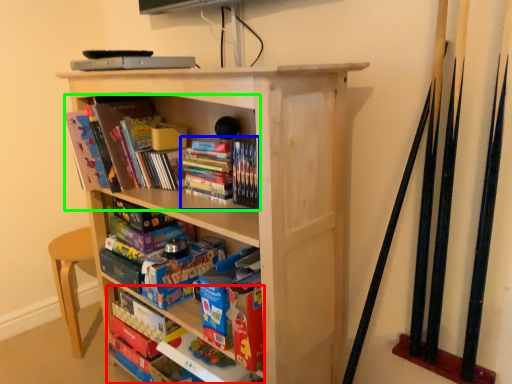
Question: Which object is positioned closest to book (highlighted by a red box)? Select from book (highlighted by a blue box) and book (highlighted by a green box).

Choices:
 (A) book
 (B) book

Answer: (A)